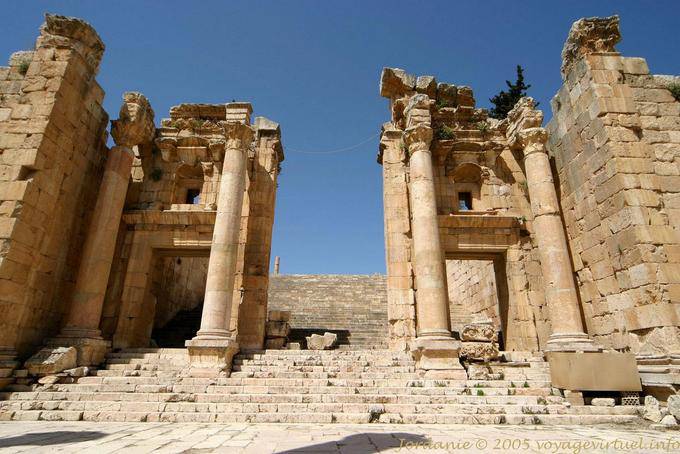
The width and height of the screenshot is (680, 454). What are the coordinates of `pillar` in the screenshot? It's located at (233, 278).